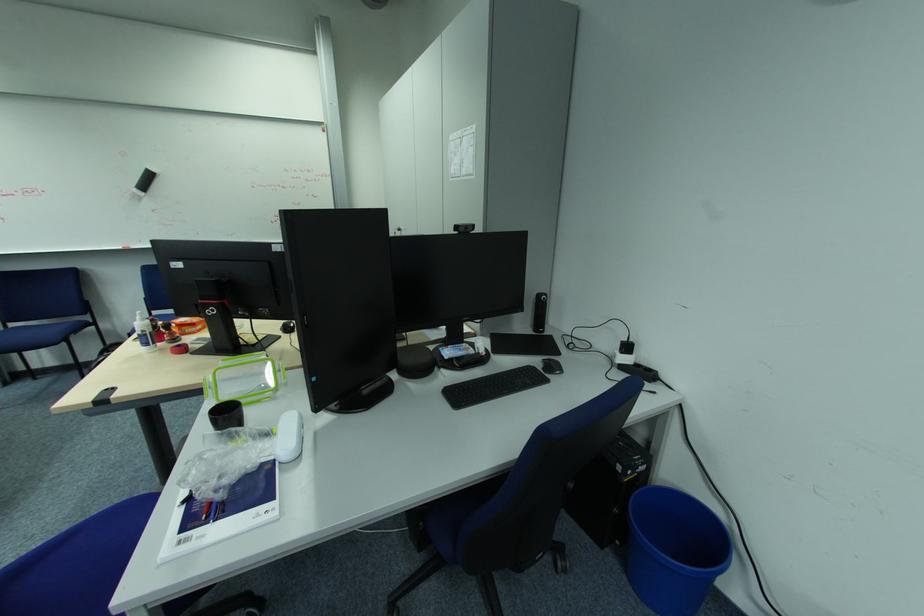
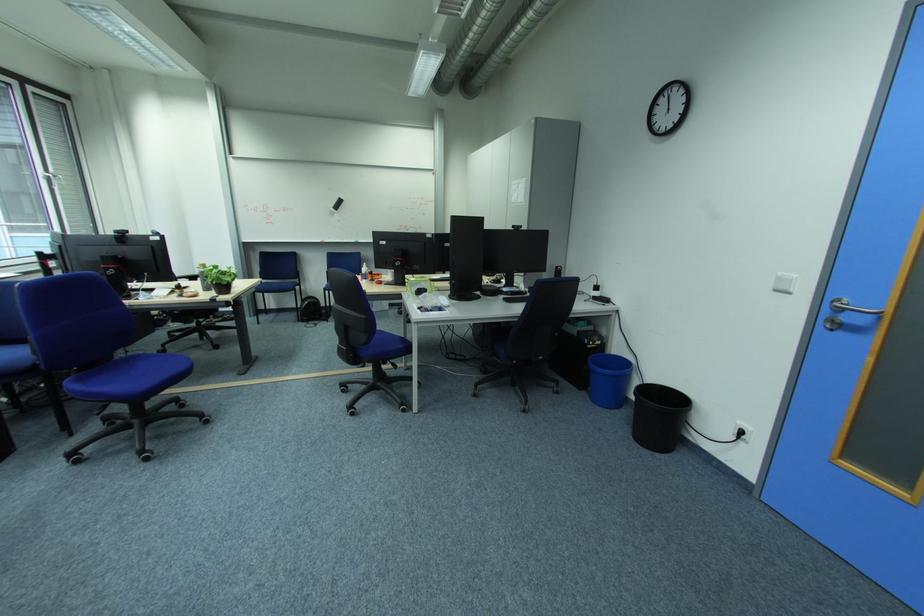
In the second image, find the point that corresponds to pixel 617 552 in the first image.

(592, 392)